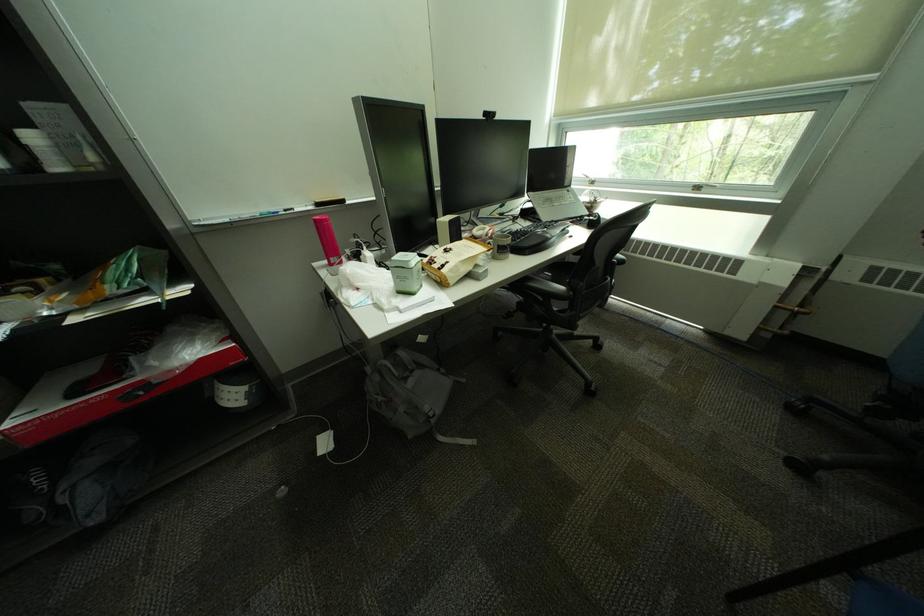
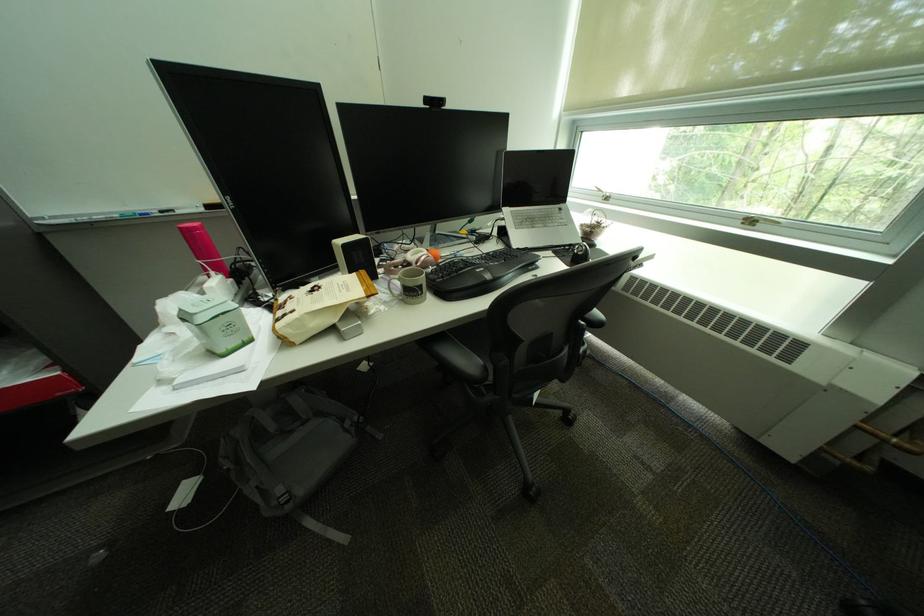
Locate, in the second image, the point that corresponds to the point at 467,267 in the first image.

(309, 321)